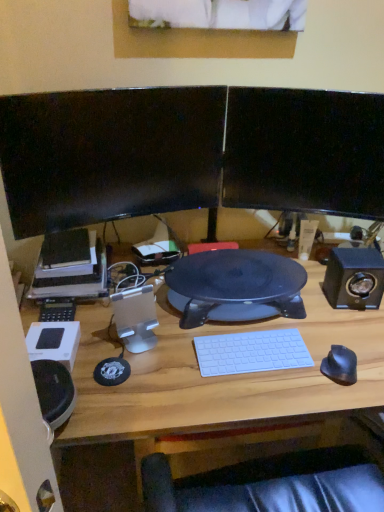
Find the location of `free area in between black matte mouse at right and white plastic keyboard at center`. free area in between black matte mouse at right and white plastic keyboard at center is located at coordinates (283, 380).